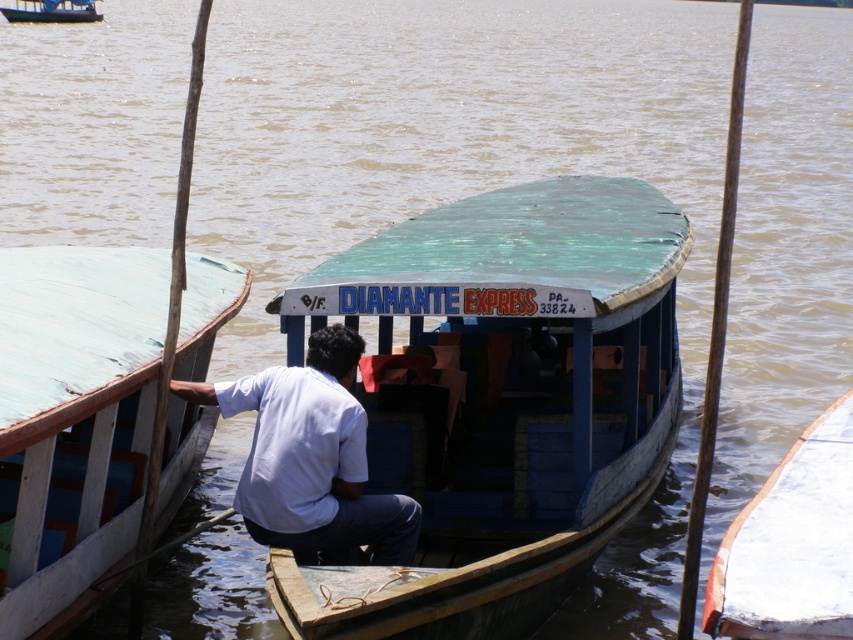
The width and height of the screenshot is (853, 640). Describe the element at coordinates (312, 458) in the screenshot. I see `white matte shirt at center` at that location.

Who is more distant from viewer, (335, 554) or (86, 19)?

The point (86, 19) is more distant.

Between point (334, 509) and point (39, 19), which one is positioned behind?

The point (39, 19) is behind.

This screenshot has height=640, width=853. What are the coordinates of `white matte shirt at center` in the screenshot? It's located at (312, 458).

Is teal wooden boat at center to the left of white glossy boat at lower right from the viewer's perspective?

Yes, teal wooden boat at center is to the left of white glossy boat at lower right.

Identify the location of teal wooden boat at center. The image size is (853, 640). (514, 392).

In the scene shown: Does teal wooden boat at center appear on the left side of green matte boat at center?

Incorrect, teal wooden boat at center is not on the left side of green matte boat at center.

Is point (428, 500) farther from viewer compared to point (96, 19)?

That is False.

I want to click on teal wooden boat at center, so click(514, 392).